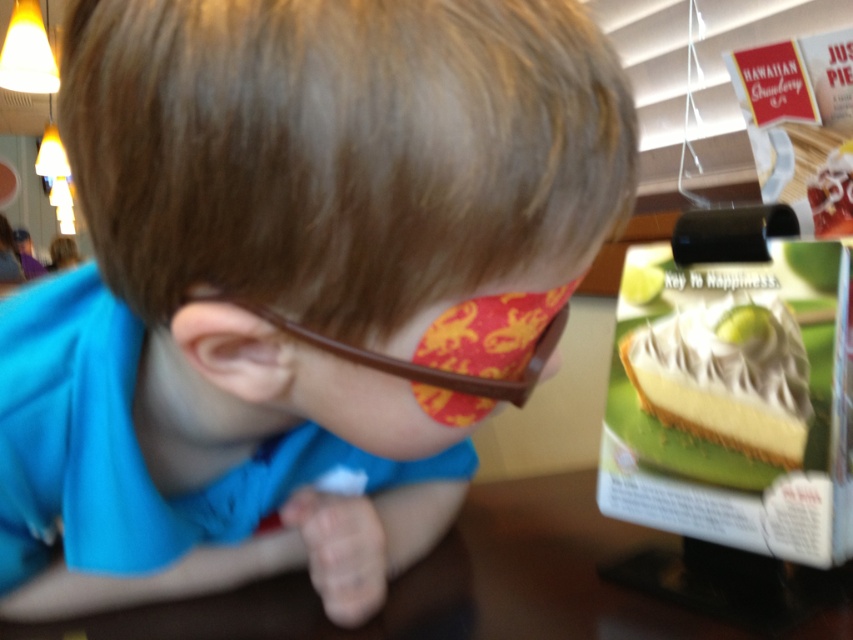
Between white paper sign at upper center and white creamy cake at right, which one has less height?

Standing shorter between the two is white creamy cake at right.

Can you confirm if white paper sign at upper center is thinner than white creamy cake at right?

Incorrect, white paper sign at upper center's width is not less than white creamy cake at right's.

Is point (640, 106) less distant than point (712, 424)?

No, it is behind (712, 424).

What are the coordinates of `white paper sign at upper center` in the screenshot? It's located at (699, 76).

Does blue fabric shirt at center have a lesser height compared to white paper sign at upper center?

Indeed, blue fabric shirt at center has a lesser height compared to white paper sign at upper center.

Where is `blue fabric shirt at center`? blue fabric shirt at center is located at coordinates (291, 284).

Who is more distant from viewer, (13, 502) or (834, 17)?

The point (834, 17) is behind.

Where is `blue fabric shirt at center`? This screenshot has width=853, height=640. blue fabric shirt at center is located at coordinates (291, 284).

Which is behind, point (82, 413) or point (409, 380)?

Point (82, 413)

Can you confirm if blue fabric shirt at center is wider than brown plastic glasses at center?

Yes.

Locate an element on the screen. blue fabric shirt at center is located at coordinates (291, 284).

Where is `blue fabric shirt at center`? The height and width of the screenshot is (640, 853). blue fabric shirt at center is located at coordinates (291, 284).